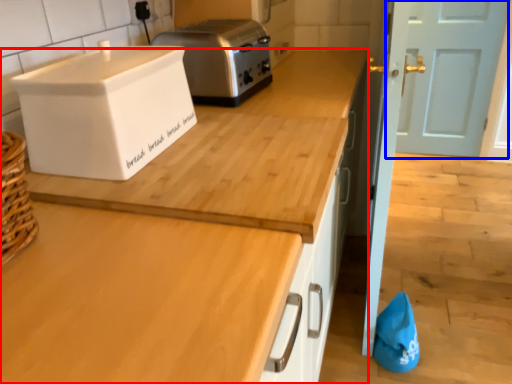
Question: Among these objects, which one is farthest to the camera, countertop (highlighted by a red box) or door (highlighted by a blue box)?

Choices:
 (A) countertop
 (B) door

Answer: (B)